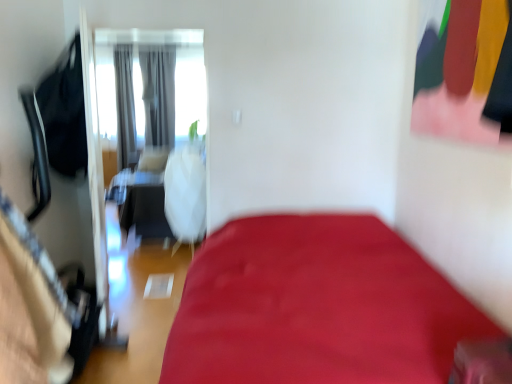
Question: From the image's perspective, is gray fabric curtain at center, the 1th curtain viewed from the right, located above or below white matte screen door at upper left?

Choices:
 (A) below
 (B) above

Answer: (B)

Question: Is point (173, 145) positioned closer to the camera than point (165, 147)?

Choices:
 (A) farther
 (B) closer

Answer: (B)

Question: Which is nearer to the white matte screen door at upper left?

Choices:
 (A) matte black clothing at upper right
 (B) gray fabric curtain at upper left, the 1th curtain in the left-to-right sequence
 (C) gray fabric curtain at center, the 1th curtain viewed from the right

Answer: (C)

Question: Which of these objects is positioned closest to the gray fabric curtain at center, the 2th curtain in the left-to-right sequence?

Choices:
 (A) gray fabric curtain at upper left, the 1th curtain in the left-to-right sequence
 (B) matte black clothing at upper right
 (C) white matte screen door at upper left

Answer: (C)